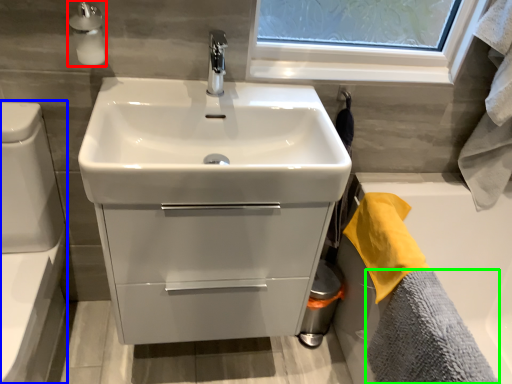
Question: Estimate the real-world distances between objects in this image. Which object is closer to soap dispenser (highlighted by a red box), toilet bowl (highlighted by a blue box) or bath towel (highlighted by a green box)?

Choices:
 (A) toilet bowl
 (B) bath towel

Answer: (A)